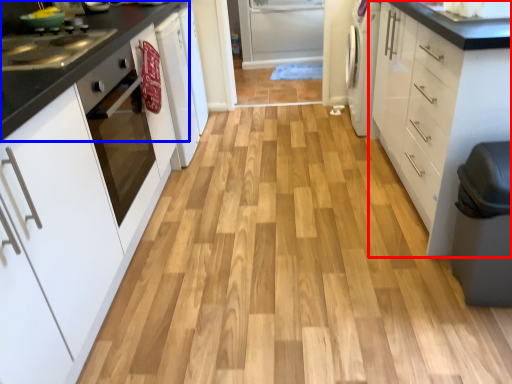
Question: Among these objects, which one is nearest to the camera, cabinetry (highlighted by a red box) or countertop (highlighted by a blue box)?

Choices:
 (A) cabinetry
 (B) countertop

Answer: (A)